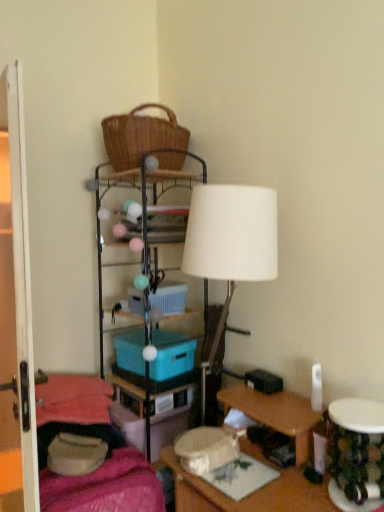
Question: Is the position of blue plastic storage box at center, arranged as the first storage box when viewed from the top, more distant than that of velvet pink blanket at lower left?

Choices:
 (A) yes
 (B) no

Answer: (A)

Question: Is blue plastic storage box at center, arranged as the first storage box when viewed from the top, located outside velvet pink blanket at lower left?

Choices:
 (A) no
 (B) yes

Answer: (B)

Question: From the image's perspective, is blue plastic storage box at center, arranged as the first storage box when viewed from the top, located beneath velvet pink blanket at lower left?

Choices:
 (A) yes
 (B) no

Answer: (B)

Question: Does blue plastic storage box at center, arranged as the first storage box when viewed from the top, have a larger size compared to velvet pink blanket at lower left?

Choices:
 (A) no
 (B) yes

Answer: (A)

Question: From the image's perspective, is blue plastic storage box at center, arranged as the first storage box when viewed from the top, on velvet pink blanket at lower left?

Choices:
 (A) no
 (B) yes

Answer: (B)

Question: Relative to woven brown picnic basket at upper center, is velvet pink blanket at lower left in front or behind?

Choices:
 (A) behind
 (B) front

Answer: (B)

Question: Considering the positions of point (135, 462) and point (117, 150), is point (135, 462) closer or farther from the camera than point (117, 150)?

Choices:
 (A) farther
 (B) closer

Answer: (B)

Question: Based on their sizes in the image, would you say velvet pink blanket at lower left is bigger or smaller than woven brown picnic basket at upper center?

Choices:
 (A) big
 (B) small

Answer: (A)

Question: Considering the positions of velvet pink blanket at lower left and woven brown picnic basket at upper center in the image, is velvet pink blanket at lower left taller or shorter than woven brown picnic basket at upper center?

Choices:
 (A) short
 (B) tall

Answer: (B)

Question: In the image, is blue plastic storage box at center, arranged as the first storage box when viewed from the top, on the left side or the right side of white matte lamp at center?

Choices:
 (A) left
 (B) right

Answer: (A)

Question: From the image's perspective, is blue plastic storage box at center, which is the 3th storage box from bottom to top, positioned above or below white matte lamp at center?

Choices:
 (A) below
 (B) above

Answer: (B)

Question: Is blue plastic storage box at center, which is the 3th storage box from bottom to top, bigger or smaller than white matte lamp at center?

Choices:
 (A) big
 (B) small

Answer: (B)

Question: From a real-world perspective, is blue plastic storage box at center, which is the 3th storage box from bottom to top, physically located above or below white matte lamp at center?

Choices:
 (A) above
 (B) below

Answer: (B)

Question: From a real-world perspective, is blue plastic storage box at center, the second storage box positioned from the bottom, above or below blue plastic storage box at center, arranged as the first storage box when viewed from the top?

Choices:
 (A) below
 (B) above

Answer: (A)

Question: From their relative heights in the image, would you say blue plastic storage box at center, which ranks as the 2th storage box in top-to-bottom order, is taller or shorter than blue plastic storage box at center, which is the 3th storage box from bottom to top?

Choices:
 (A) tall
 (B) short

Answer: (A)